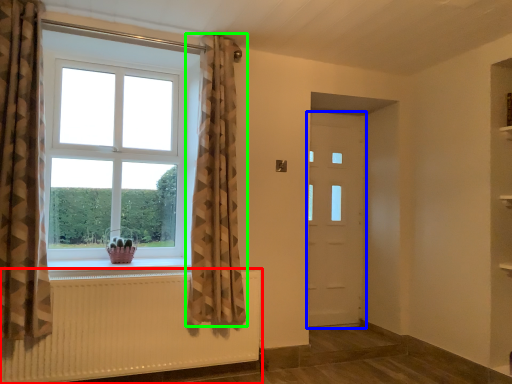
Question: Which object is positioned farthest from radiator (highlighted by a red box)? Select from door (highlighted by a blue box) and curtain (highlighted by a green box).

Choices:
 (A) door
 (B) curtain

Answer: (A)